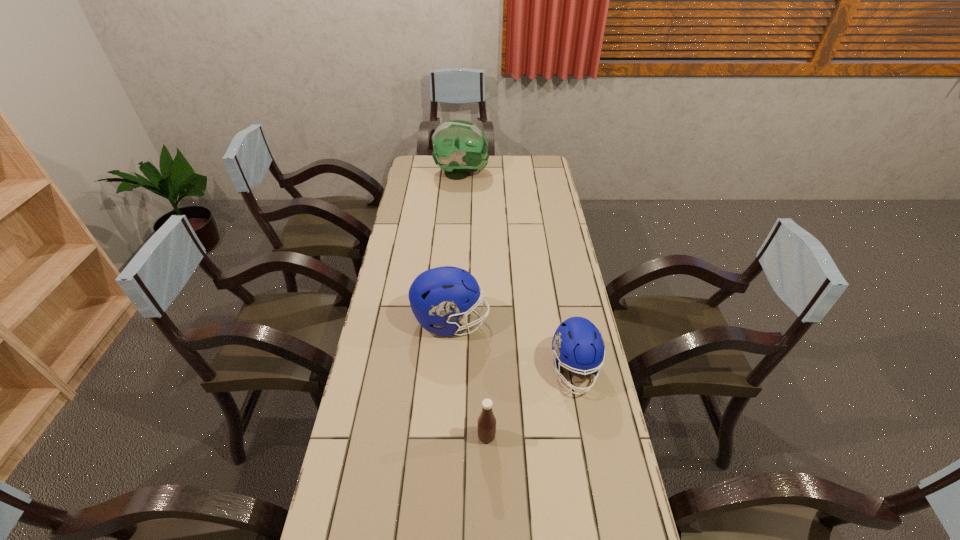
The height and width of the screenshot is (540, 960). Identify the location of object present at the far edge. (460, 147).

I want to click on object that is positioned at the right edge, so click(577, 343).

Where is `object that is at the far left corner`? object that is at the far left corner is located at coordinates (460, 147).

Identify the location of vacant space at the far edge. (516, 159).

In the image, there is a desktop. At what (x,y) coordinates should I click in order to perform the action: click on vacant space at the left edge. Please return your answer as a coordinate pair (x, y). The image size is (960, 540). Looking at the image, I should click on (383, 529).

This screenshot has height=540, width=960. Find the location of `free space at the right edge of the desktop`. free space at the right edge of the desktop is located at coordinates (537, 272).

At what (x,y) coordinates should I click in order to perform the action: click on vacant space at the far left corner of the desktop. Please return your answer as a coordinate pair (x, y). Looking at the image, I should click on (424, 158).

The image size is (960, 540). What are the coordinates of `free space between the second tallest object and the shortest football helmet` in the screenshot? It's located at (513, 346).

Locate an element on the screen. The height and width of the screenshot is (540, 960). vacant area that lies between the farthest football helmet and the shortest football helmet is located at coordinates (517, 272).

Where is `vacant space that is in between the second tallest object and the farthest football helmet`? The image size is (960, 540). vacant space that is in between the second tallest object and the farthest football helmet is located at coordinates (456, 248).